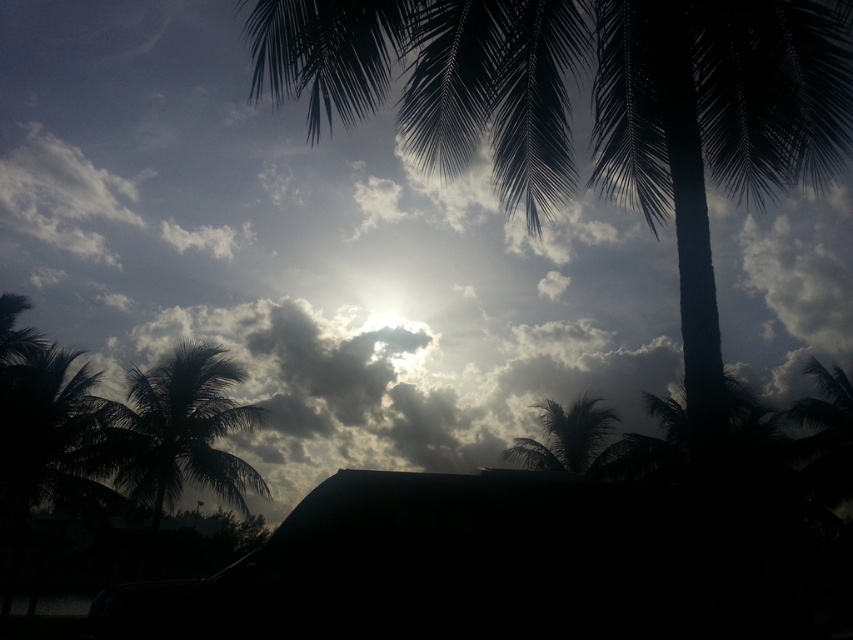
Does silhouette leafy tree at center appear under silhouette leafy palm at left?

No, silhouette leafy tree at center is not below silhouette leafy palm at left.

Who is positioned more to the right, silhouette leafy tree at center or silhouette leafy palm at left?

From the viewer's perspective, silhouette leafy tree at center appears more on the right side.

I want to click on silhouette leafy tree at center, so click(592, 109).

Locate an element on the screen. The image size is (853, 640). silhouette leafy tree at center is located at coordinates (592, 109).

Between silhouette leafy palm at left and silky green palm tree at center, which one has less height?

Standing shorter between the two is silky green palm tree at center.

Who is higher up, silhouette leafy palm at left or silky green palm tree at center?

silhouette leafy palm at left is above.

Who is more distant from viewer, (x=225, y=406) or (x=537, y=467)?

The point (x=537, y=467) is behind.

Locate an element on the screen. Image resolution: width=853 pixels, height=640 pixels. silhouette leafy palm at left is located at coordinates coord(178,432).

Can you confirm if silhouette leafy tree at center is wider than silky green palm tree at center?

No, silhouette leafy tree at center is not wider than silky green palm tree at center.

Consider the image. Is silhouette leafy tree at center smaller than silky green palm tree at center?

Correct, silhouette leafy tree at center occupies less space than silky green palm tree at center.

Identify the location of silhouette leafy tree at center. (592, 109).